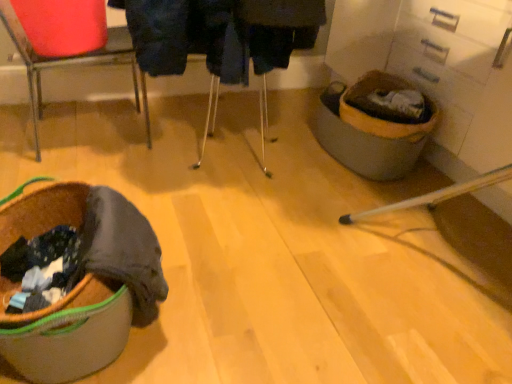
Question: Is brown fabric laundry basket at lower left smaller than metallic red chair at upper left?

Choices:
 (A) no
 (B) yes

Answer: (B)

Question: Can you confirm if brown fabric laundry basket at lower left is bigger than metallic red chair at upper left?

Choices:
 (A) no
 (B) yes

Answer: (A)

Question: Does brown fabric laundry basket at lower left appear on the left side of metallic red chair at upper left?

Choices:
 (A) no
 (B) yes

Answer: (A)

Question: Is brown fabric laundry basket at lower left thinner than metallic red chair at upper left?

Choices:
 (A) yes
 (B) no

Answer: (B)

Question: From the image's perspective, is brown fabric laundry basket at lower left located beneath metallic red chair at upper left?

Choices:
 (A) no
 (B) yes

Answer: (B)

Question: Can you confirm if brown fabric laundry basket at lower left is taller than metallic red chair at upper left?

Choices:
 (A) yes
 (B) no

Answer: (B)

Question: Is metallic red chair at upper left in front of brown fabric laundry basket at lower left?

Choices:
 (A) yes
 (B) no

Answer: (B)

Question: Is metallic red chair at upper left next to brown fabric laundry basket at lower left and touching it?

Choices:
 (A) yes
 (B) no

Answer: (B)

Question: Does metallic red chair at upper left have a greater width compared to brown fabric laundry basket at lower left?

Choices:
 (A) no
 (B) yes

Answer: (A)

Question: Is brown fabric laundry basket at lower left located within metallic red chair at upper left?

Choices:
 (A) no
 (B) yes

Answer: (A)

Question: Is metallic red chair at upper left shorter than brown fabric laundry basket at lower left?

Choices:
 (A) yes
 (B) no

Answer: (B)

Question: From a real-world perspective, is metallic red chair at upper left below brown fabric laundry basket at lower left?

Choices:
 (A) no
 (B) yes

Answer: (A)

Question: In the image, is metallic red chair at upper left positioned in front of or behind brown fabric laundry basket at lower left?

Choices:
 (A) behind
 (B) front

Answer: (A)